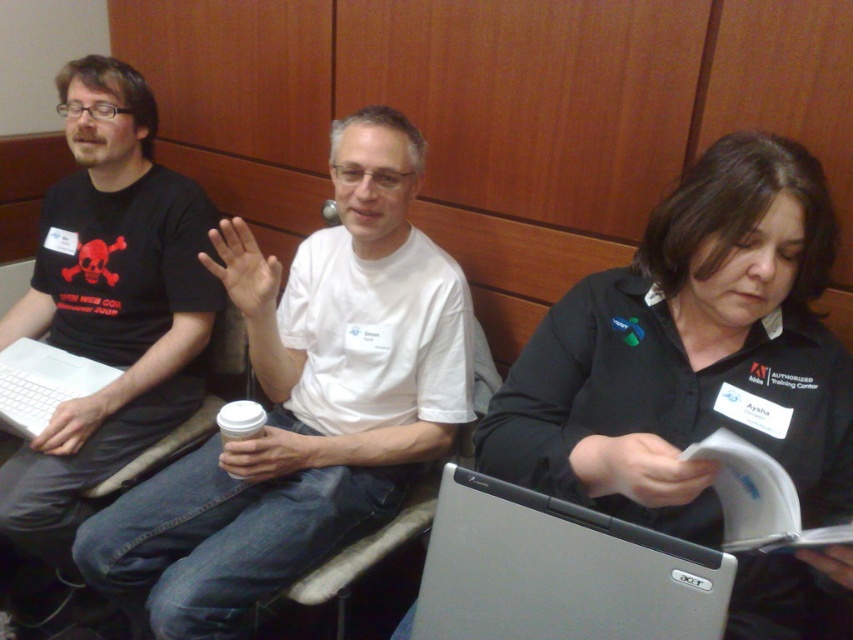
You are a photographer in this conference room. You need to take a photo of the black fabric shirt at center and the faux leather chair at center. Can you see both objects in the same photo without moving the camera?

Yes, the black fabric shirt at center is positioned over the faux leather chair at center, so they are in the same location and can be captured in a single photo.

What is the object located at the coordinates point (558, 572) in the image?

The object located at point (558, 572) is the silver metallic laptop at center.